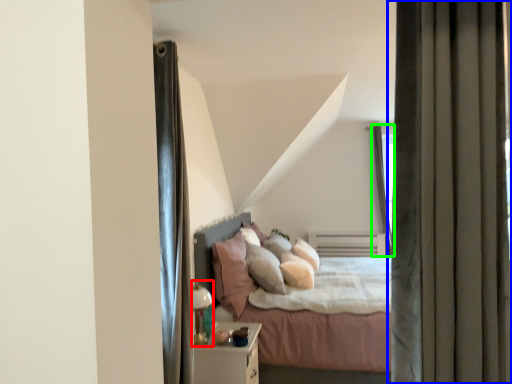
Question: Considering the real-world distances, which object is farthest from lamp (highlighted by a red box)? curtain (highlighted by a blue box) or glass door (highlighted by a green box)?

Choices:
 (A) curtain
 (B) glass door

Answer: (B)